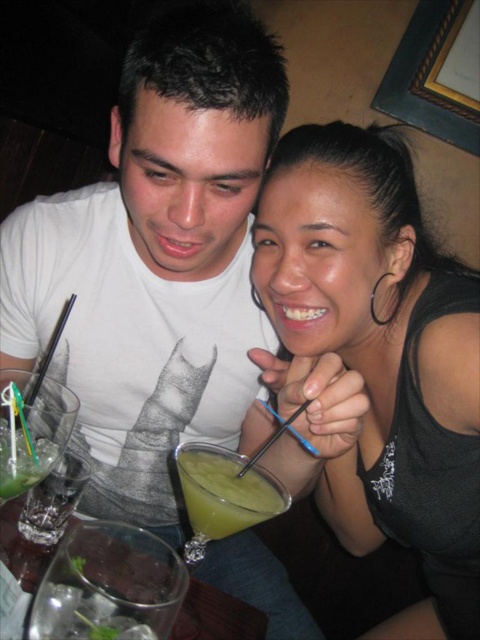
You are at a bar and want to order a drink. The bartender points to the menu at point (225, 492). What is the drink at that point?

The drink at point (225, 492) is the green smoothie at center.

You are at a cafe and want to order a drink. You see the green smoothie at center and the green translucent glass at lower left. Which one is closer to the edge of the table?

The green translucent glass at lower left is closer to the edge of the table because the green smoothie at center is located below it, meaning the glass is positioned higher up and nearer to the edge.